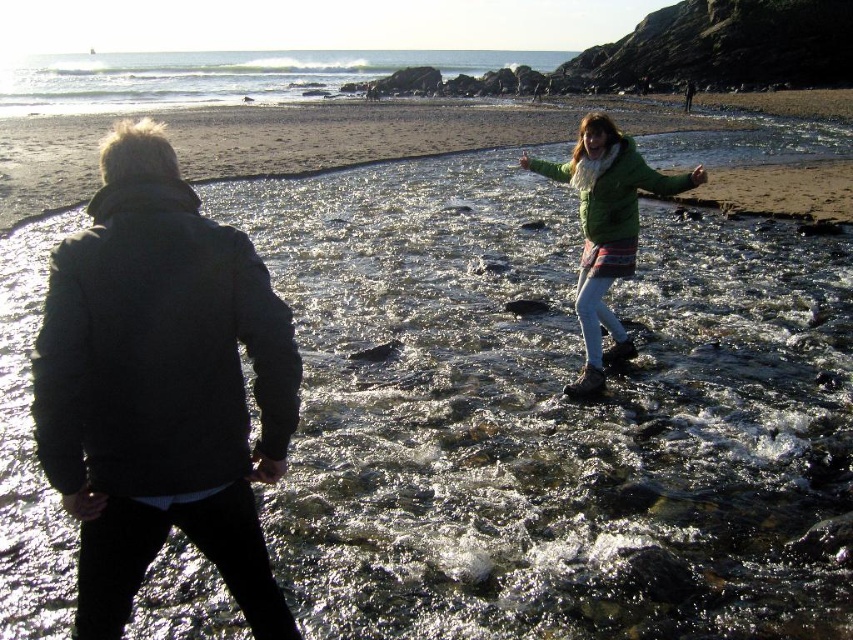
How distant is smooth sand beach at upper center from clear water at upper center?

They are 55.77 meters apart.

Is smooth sand beach at upper center wider than clear water at upper center?

In fact, smooth sand beach at upper center might be narrower than clear water at upper center.

Does point (397, 132) come in front of point (299, 74)?

Yes, point (397, 132) is closer to viewer.

What are the coordinates of `smooth sand beach at upper center` in the screenshot? It's located at [352, 132].

Does dark gray wool jacket at left have a greater height compared to smooth sand beach at upper center?

In fact, dark gray wool jacket at left may be shorter than smooth sand beach at upper center.

Which is above, dark gray wool jacket at left or smooth sand beach at upper center?

smooth sand beach at upper center is higher up.

Is point (99, 163) positioned in front of point (566, 138)?

Yes, it is in front of point (566, 138).

This screenshot has height=640, width=853. What are the coordinates of `dark gray wool jacket at left` in the screenshot? It's located at (x=161, y=387).

Who is taller, green woolen jacket at upper right or smooth sand beach at upper center?

Standing taller between the two is smooth sand beach at upper center.

Does point (117, 422) come farther from viewer compared to point (686, 129)?

No, it is not.

Is point (146, 339) behind point (688, 115)?

No, (146, 339) is closer to viewer.

Find the location of a particular element. green woolen jacket at upper right is located at coordinates (161, 387).